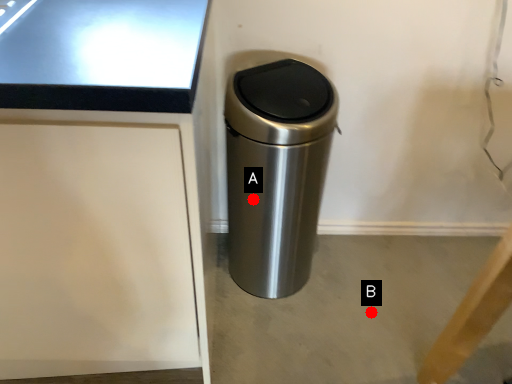
Question: Two points are circled on the image, labeled by A and B beside each circle. Which point is closer to the camera?

Choices:
 (A) A is closer
 (B) B is closer

Answer: (A)